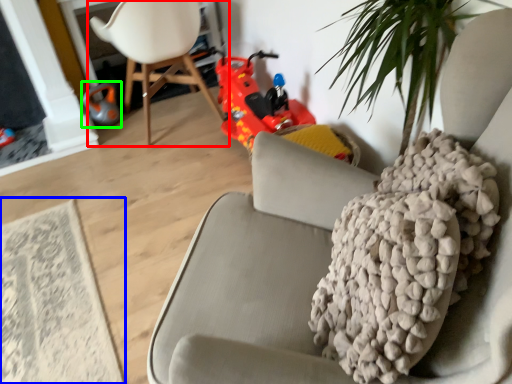
Question: Which is nearer to the chair (highlighted by a red box)? mat (highlighted by a blue box) or toy (highlighted by a green box).

Choices:
 (A) mat
 (B) toy

Answer: (B)